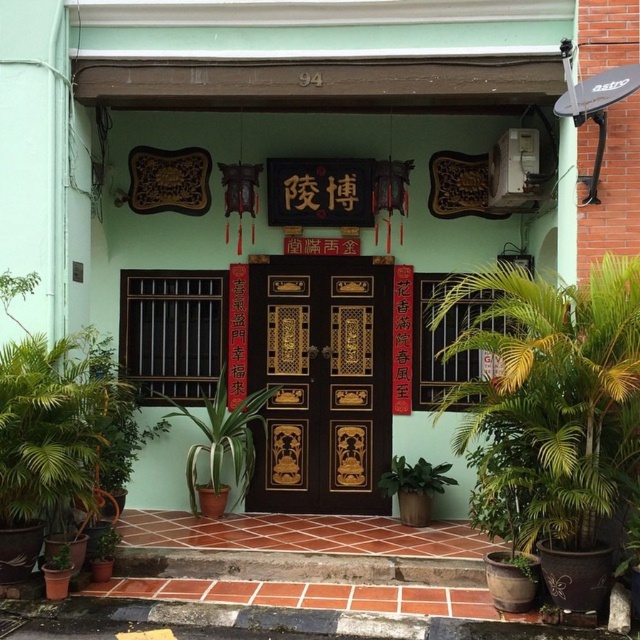
You are standing at the entrance of the building and want to place a decorative item exactly at the center of the entrance. Is the green matte plant at center already positioned there?

The green matte plant at center is positioned at point (221,444), so it is not exactly at the center of the entrance.

You are standing at the entrance of the building and want to place a new small statue between the green leafy plant at right and the green leafy plant at lower left. Which plant should the statue be closer to if you want it to be near the shorter one?

The green leafy plant at lower left is shorter than the green leafy plant at right. Therefore, the statue should be placed closer to the green leafy plant at lower left to be near the shorter one.

You are a visitor at the entrance of this traditional building and want to take a photo of both the green leafy plant at right and the green matte plant at center. Which plant should you focus on first to ensure both are in the frame?

You should focus on the green leafy plant at right first since it is bigger than the green matte plant at center, ensuring it fits within the camera frame while still capturing the smaller plant in the background.